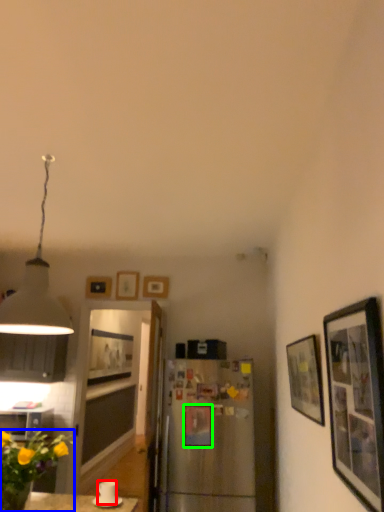
Question: Estimate the real-world distances between objects in this image. Which object is farther from coffee cup (highlighted by a red box), flower (highlighted by a blue box) or picture frame (highlighted by a green box)?

Choices:
 (A) flower
 (B) picture frame

Answer: (B)